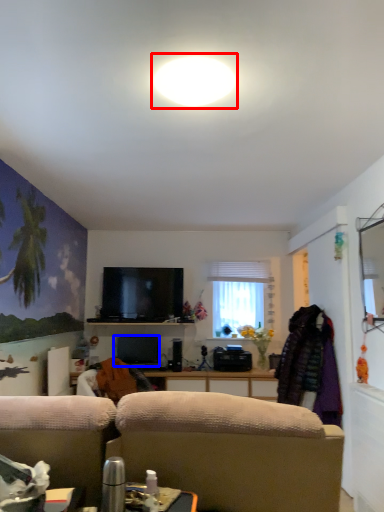
Question: Which point is further to the camera, bright (highlighted by a red box) or television (highlighted by a blue box)?

Choices:
 (A) bright
 (B) television

Answer: (B)